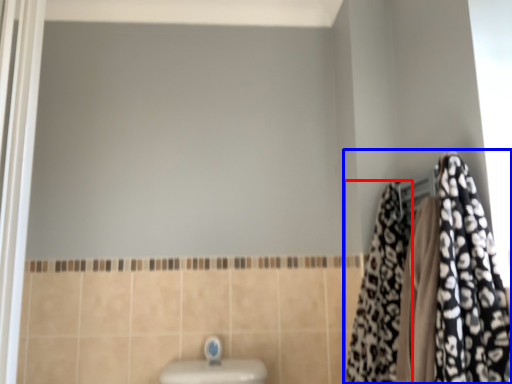
Question: Which of the following is the farthest to the observer, cloth (highlighted by a red box) or closet (highlighted by a blue box)?

Choices:
 (A) cloth
 (B) closet

Answer: (A)